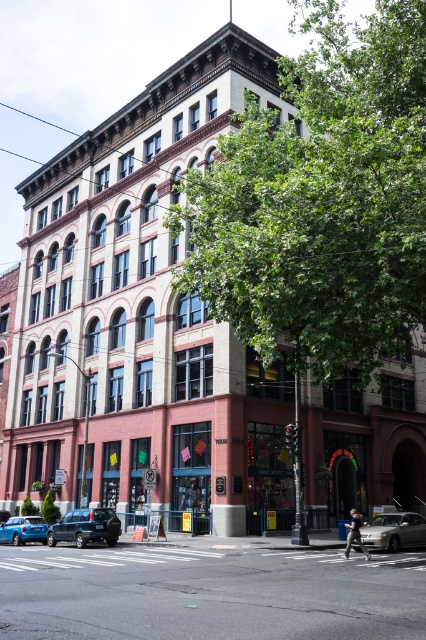
Question: Does green leafy tree at upper center have a greater width compared to metallic blue sedan at lower left?

Choices:
 (A) yes
 (B) no

Answer: (A)

Question: Which object is farther from the camera taking this photo?

Choices:
 (A) black matte suv at lower left
 (B) green leafy tree at upper center
 (C) black asphalt at center

Answer: (A)

Question: From the image, what is the correct spatial relationship of black asphalt at center in relation to black matte suv at lower left?

Choices:
 (A) right
 (B) left

Answer: (A)

Question: Where is green leafy tree at upper center located in relation to black asphalt at center in the image?

Choices:
 (A) above
 (B) below

Answer: (A)

Question: Considering the real-world distances, which object is closest to the black matte suv at lower left?

Choices:
 (A) silver metallic sedan at lower right
 (B) metallic blue sedan at lower left
 (C) green leafy tree at upper center
 (D) black asphalt at center

Answer: (B)

Question: Which point appears closest to the camera in this image?

Choices:
 (A) (402, 529)
 (B) (14, 538)
 (C) (25, 611)

Answer: (C)